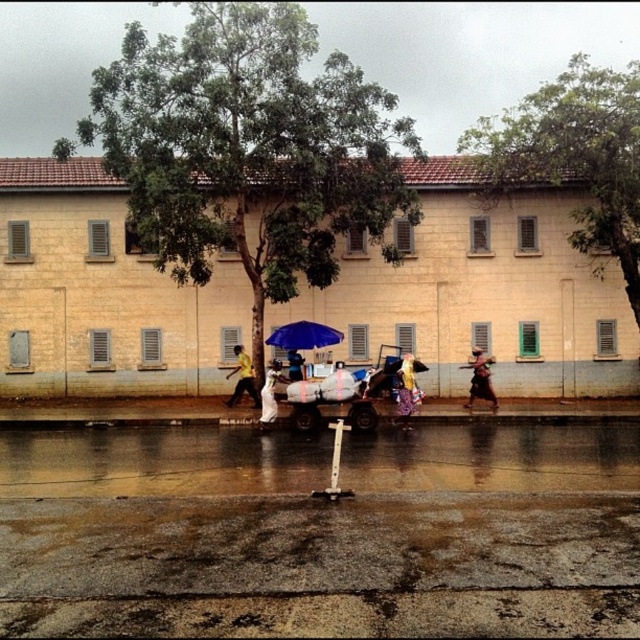
Based on the photo, you are standing on the rainy street in front of the beige building and see both the yellow fabric dress at center and the yellow matte shirt at center. Which one is nearer to you?

The yellow fabric dress at center is closer to the viewer than the yellow matte shirt at center.

You are a pedestrian standing on the rainy street in front of the beige building. You notice two yellow items at the center of the scene. Which one is positioned lower down between the yellow fabric dress at center and the matte yellow shirt at center?

The yellow fabric dress at center is located below the matte yellow shirt at center, so the yellow fabric dress at center is positioned lower down.